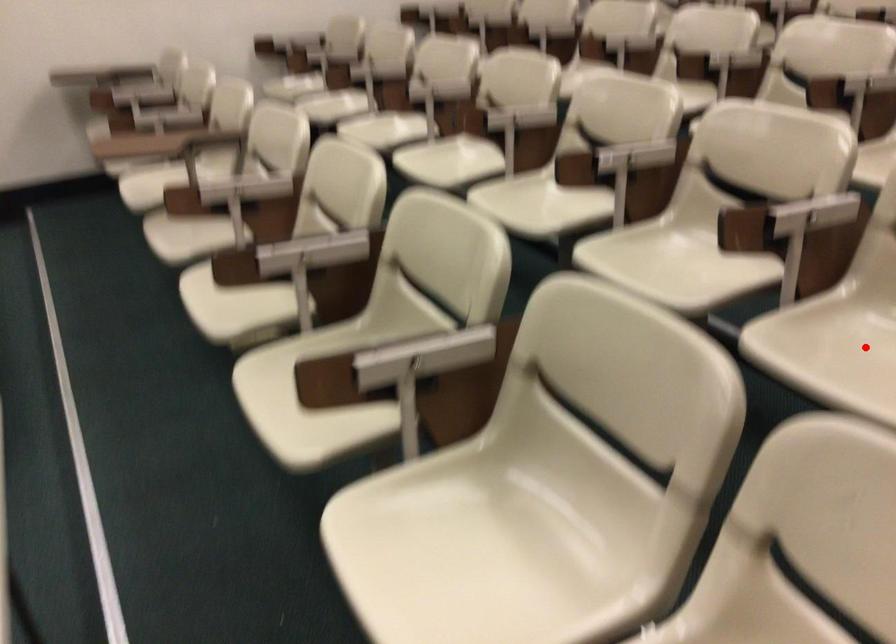
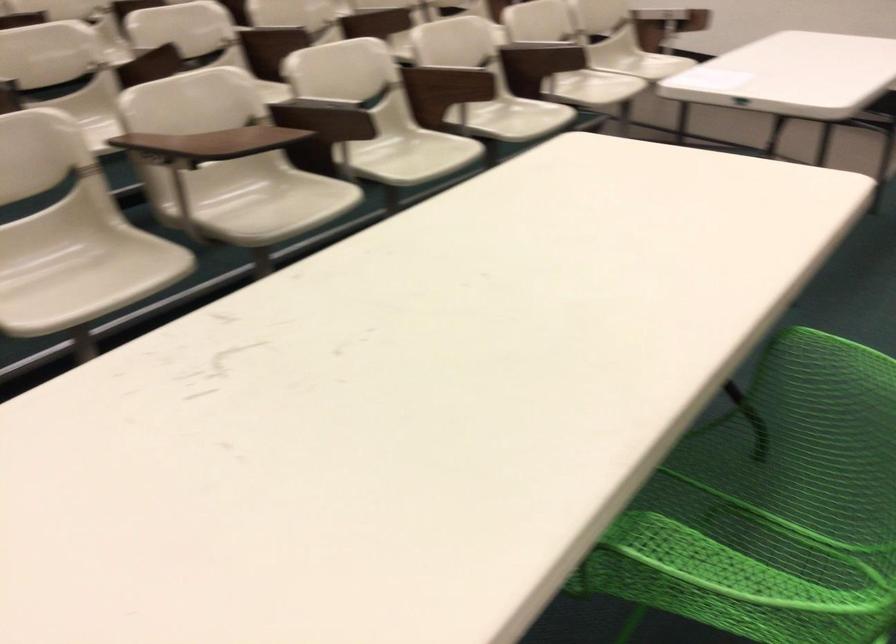
Question: I am providing you with two images of the same scene from different viewpoints. A red point is marked on the first image. At the location where the point appears in image 1, is it still visible in image 2?

Choices:
 (A) Yes
 (B) No

Answer: (B)